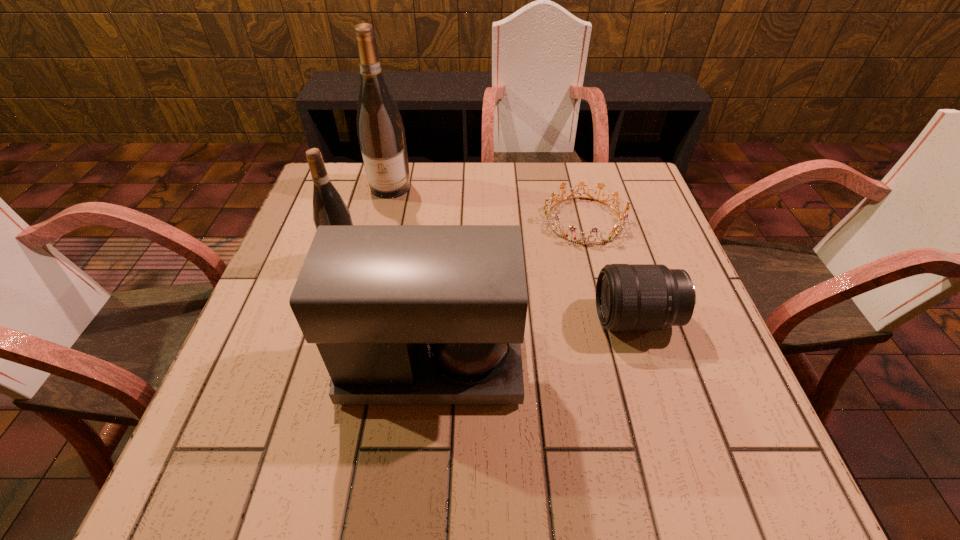
I want to click on the taller wine bottle, so click(x=381, y=134).

Where is `the tallest object`? the tallest object is located at coordinates (381, 134).

Where is `the shorter wine bottle`? the shorter wine bottle is located at coordinates (329, 208).

Where is `the nearer wine bottle`? The height and width of the screenshot is (540, 960). the nearer wine bottle is located at coordinates 329,208.

The image size is (960, 540). In order to click on coffee maker in this screenshot , I will do `click(401, 314)`.

The height and width of the screenshot is (540, 960). I want to click on telephoto lens, so click(629, 297).

Locate an element on the screen. tiara is located at coordinates (618, 230).

Where is `vacant region located on the label of the farther wine bottle`? The image size is (960, 540). vacant region located on the label of the farther wine bottle is located at coordinates (363, 300).

The image size is (960, 540). Find the location of `free space located 0.300m on the back of the third farthest object`. free space located 0.300m on the back of the third farthest object is located at coordinates (370, 179).

At what (x,y) coordinates should I click in order to perform the action: click on free space located on the carafe side of the coffee maker. Please return your answer as a coordinate pair (x, y). Image resolution: width=960 pixels, height=540 pixels. Looking at the image, I should click on (557, 364).